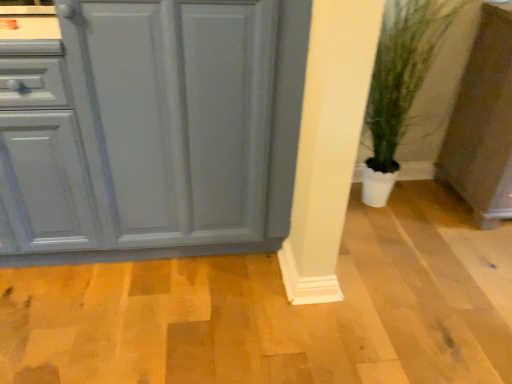
Question: From a real-world perspective, is matte gray cabinet at lower right, which is the second cabinetry from left to right, physically above green leafy plant in pot at lower right?

Choices:
 (A) no
 (B) yes

Answer: (A)

Question: Is green leafy plant in pot at lower right surrounded by matte gray cabinet at lower right, which is the second cabinetry from left to right?

Choices:
 (A) no
 (B) yes

Answer: (A)

Question: Does matte gray cabinet at lower right, which is the 1th cabinetry from right to left, have a lesser height compared to green leafy plant in pot at lower right?

Choices:
 (A) yes
 (B) no

Answer: (A)

Question: Is matte gray cabinet at lower right, which is the second cabinetry from left to right, thinner than green leafy plant in pot at lower right?

Choices:
 (A) yes
 (B) no

Answer: (B)

Question: Is matte gray cabinet at lower right, which is the 1th cabinetry from right to left, at the left side of green leafy plant in pot at lower right?

Choices:
 (A) no
 (B) yes

Answer: (A)

Question: Is green leafy plant in pot at lower right at the back of matte gray cabinet at lower right, which is the second cabinetry from left to right?

Choices:
 (A) no
 (B) yes

Answer: (A)

Question: Could you tell me if green leafy plant in pot at lower right is turned towards matte gray cabinet at left, which appears as the first cabinetry when viewed from the left?

Choices:
 (A) no
 (B) yes

Answer: (A)

Question: Can you confirm if green leafy plant in pot at lower right is positioned to the right of matte gray cabinet at left, which appears as the first cabinetry when viewed from the left?

Choices:
 (A) yes
 (B) no

Answer: (A)

Question: From a real-world perspective, is green leafy plant in pot at lower right beneath matte gray cabinet at left, which is the 2th cabinetry from right to left?

Choices:
 (A) yes
 (B) no

Answer: (A)

Question: Is green leafy plant in pot at lower right taller than matte gray cabinet at left, which is the 2th cabinetry from right to left?

Choices:
 (A) yes
 (B) no

Answer: (A)

Question: Is green leafy plant in pot at lower right thinner than matte gray cabinet at left, which is the 2th cabinetry from right to left?

Choices:
 (A) no
 (B) yes

Answer: (B)

Question: Considering the relative sizes of green leafy plant in pot at lower right and matte gray cabinet at left, which is the 2th cabinetry from right to left, in the image provided, is green leafy plant in pot at lower right wider than matte gray cabinet at left, which is the 2th cabinetry from right to left,?

Choices:
 (A) yes
 (B) no

Answer: (B)

Question: From a real-world perspective, does matte gray cabinet at lower right, which is the 1th cabinetry from right to left, sit lower than matte gray cabinet at left, which appears as the first cabinetry when viewed from the left?

Choices:
 (A) no
 (B) yes

Answer: (B)